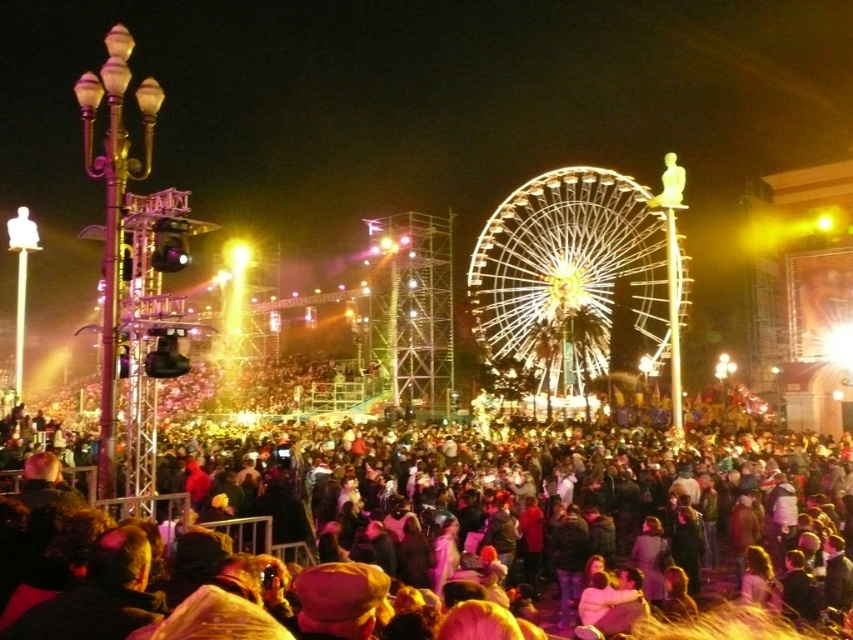
Who is positioned more to the right, dark brown fabric crowd at center or illuminated steel ferris wheel at center?

illuminated steel ferris wheel at center is more to the right.

Which is in front, point (422, 544) or point (676, 344)?

Point (422, 544) is more forward.

Find the location of `dark brown fabric crowd at center`. dark brown fabric crowd at center is located at coordinates (474, 516).